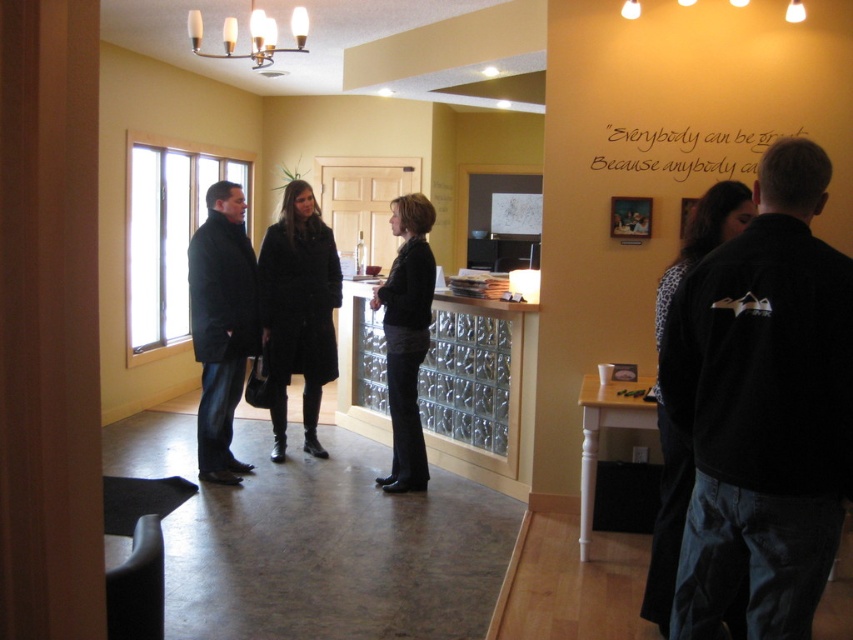
Is black fleece jacket at right shorter than dark gray coat at left?

Yes.

Consider the image. Does black fleece jacket at right appear over dark gray coat at left?

Actually, black fleece jacket at right is below dark gray coat at left.

The height and width of the screenshot is (640, 853). I want to click on black fleece jacket at right, so tap(763, 408).

Is point (334, 276) positioned behind point (392, 454)?

Yes, point (334, 276) is farther from viewer.

Does black wool coat at center have a larger size compared to dark gray sweater at center?

Indeed, black wool coat at center has a larger size compared to dark gray sweater at center.

The image size is (853, 640). Describe the element at coordinates (299, 310) in the screenshot. I see `black wool coat at center` at that location.

The image size is (853, 640). I want to click on black wool coat at center, so click(x=299, y=310).

Does black fleece jacket at right have a larger size compared to black wool coat at center?

Incorrect, black fleece jacket at right is not larger than black wool coat at center.

How distant is black fleece jacket at right from black wool coat at center?

black fleece jacket at right and black wool coat at center are 3.24 meters apart.

Between point (796, 170) and point (310, 260), which one is positioned in front?

Point (796, 170) is more forward.

Identify the location of black fleece jacket at right. Image resolution: width=853 pixels, height=640 pixels. (763, 408).